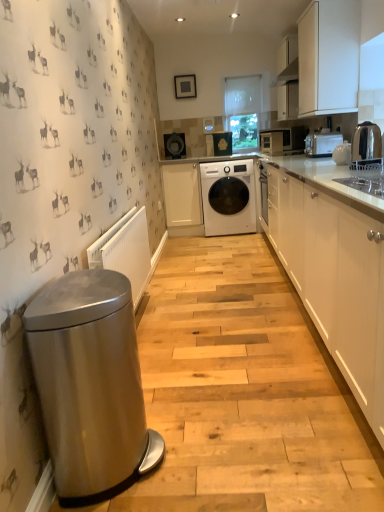
Locate an element on the screen. empty space that is ontop of white plastic radiator at lower left (from a real-world perspective) is located at coordinates (113, 225).